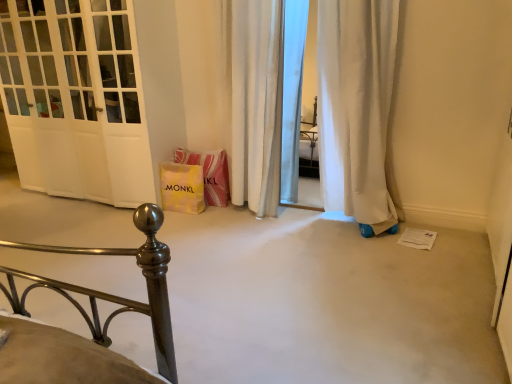
Question: Considering the relative sizes of yellow paper bag at center and white glossy door at left in the image provided, is yellow paper bag at center thinner than white glossy door at left?

Choices:
 (A) no
 (B) yes

Answer: (B)

Question: Does yellow paper bag at center appear on the right side of white glossy door at left?

Choices:
 (A) no
 (B) yes

Answer: (B)

Question: Is yellow paper bag at center far away from white glossy door at left?

Choices:
 (A) yes
 (B) no

Answer: (B)

Question: Is yellow paper bag at center closer to the viewer compared to white glossy door at left?

Choices:
 (A) yes
 (B) no

Answer: (B)

Question: Is yellow paper bag at center not inside white glossy door at left?

Choices:
 (A) no
 (B) yes

Answer: (B)

Question: Which is correct: white fabric curtain at center is inside yellow paper bag at lower center, or outside of it?

Choices:
 (A) outside
 (B) inside

Answer: (A)

Question: In the image, is white fabric curtain at center positioned in front of or behind yellow paper bag at lower center?

Choices:
 (A) behind
 (B) front

Answer: (B)

Question: Is white fabric curtain at center wider or thinner than yellow paper bag at lower center?

Choices:
 (A) thin
 (B) wide

Answer: (B)

Question: Visually, is white fabric curtain at center positioned to the left or to the right of yellow paper bag at lower center?

Choices:
 (A) left
 (B) right

Answer: (B)

Question: Based on their positions, is yellow paper bag at lower center located to the left or right of yellow paper bag at center?

Choices:
 (A) right
 (B) left

Answer: (A)

Question: Which is correct: yellow paper bag at lower center is inside yellow paper bag at center, or outside of it?

Choices:
 (A) inside
 (B) outside

Answer: (B)

Question: From the image's perspective, is yellow paper bag at lower center positioned above or below yellow paper bag at center?

Choices:
 (A) below
 (B) above

Answer: (B)

Question: Is yellow paper bag at lower center in front of or behind yellow paper bag at center in the image?

Choices:
 (A) behind
 (B) front

Answer: (A)

Question: Considering the relative positions of yellow paper bag at lower center and white glossy door at left in the image provided, is yellow paper bag at lower center to the left or to the right of white glossy door at left?

Choices:
 (A) right
 (B) left

Answer: (A)

Question: Considering the positions of point pos(214,168) and point pos(79,3), is point pos(214,168) closer or farther from the camera than point pos(79,3)?

Choices:
 (A) farther
 (B) closer

Answer: (A)